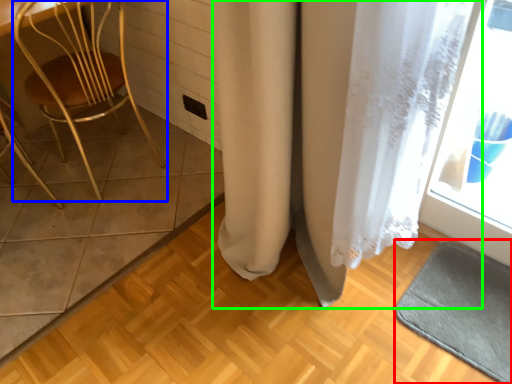
Question: Which object is the closest to the bath mat (highlighted by a red box)? Choose among these: chair (highlighted by a blue box) or curtain (highlighted by a green box).

Choices:
 (A) chair
 (B) curtain

Answer: (B)